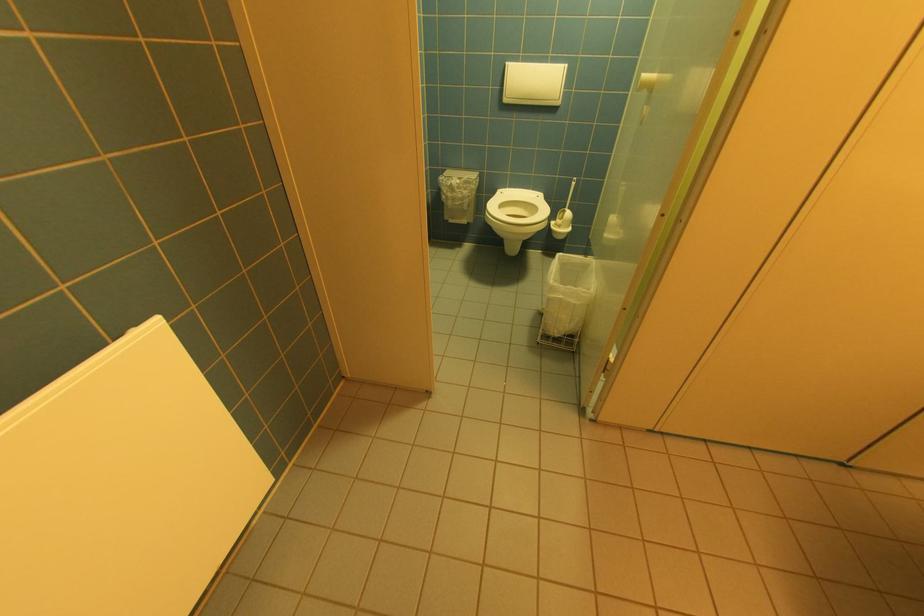
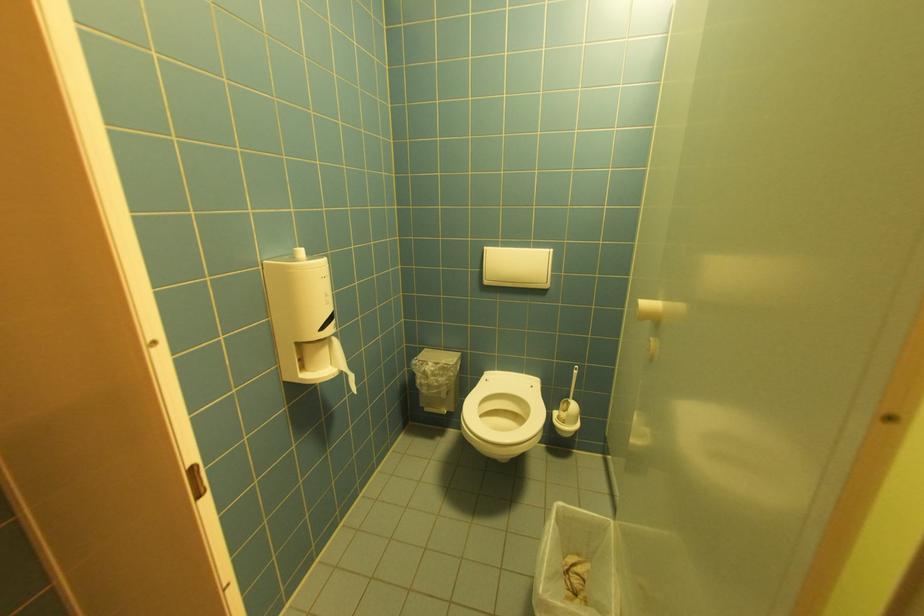
Locate, in the second image, the point that corresponds to the point at 657,87 in the first image.

(663, 321)